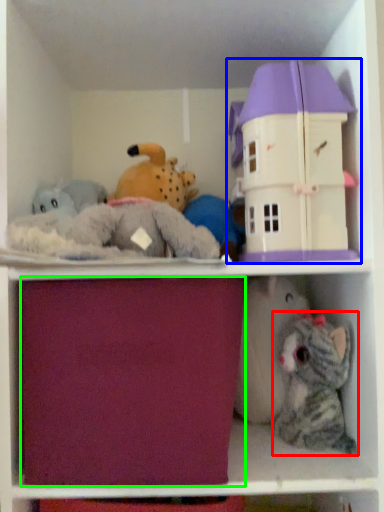
Question: Considering the real-world distances, which object is farthest from toy (highlighted by a red box)? toy (highlighted by a blue box) or drawer (highlighted by a green box)?

Choices:
 (A) toy
 (B) drawer

Answer: (B)